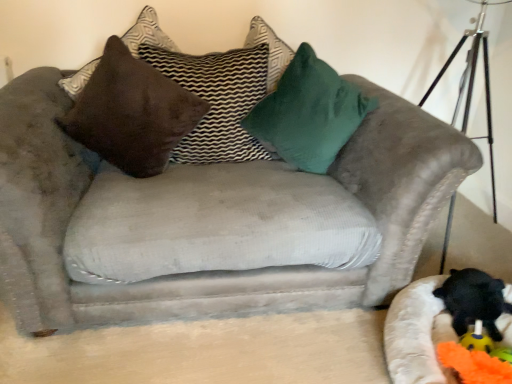
Question: Considering the relative sizes of orange fabric toy at lower right and black plush toy at lower right in the image provided, is orange fabric toy at lower right shorter than black plush toy at lower right?

Choices:
 (A) yes
 (B) no

Answer: (A)

Question: From the image's perspective, would you say orange fabric toy at lower right is shown under black plush toy at lower right?

Choices:
 (A) yes
 (B) no

Answer: (A)

Question: From the image's perspective, is orange fabric toy at lower right above black plush toy at lower right?

Choices:
 (A) no
 (B) yes

Answer: (A)

Question: Is black plush toy at lower right a part of orange fabric toy at lower right?

Choices:
 (A) no
 (B) yes

Answer: (A)

Question: Is orange fabric toy at lower right positioned in front of black plush toy at lower right?

Choices:
 (A) yes
 (B) no

Answer: (A)

Question: Would you say orange fabric toy at lower right is outside black plush toy at lower right?

Choices:
 (A) yes
 (B) no

Answer: (A)

Question: Is green velvet pillow at upper center, the 1th pillow positioned from the right, looking in the opposite direction of orange fabric toy at lower right?

Choices:
 (A) no
 (B) yes

Answer: (A)

Question: Is green velvet pillow at upper center, the 1th pillow positioned from the right, behind orange fabric toy at lower right?

Choices:
 (A) no
 (B) yes

Answer: (B)

Question: Does green velvet pillow at upper center, the 1th pillow positioned from the right, appear on the right side of orange fabric toy at lower right?

Choices:
 (A) no
 (B) yes

Answer: (A)

Question: Considering the relative sizes of green velvet pillow at upper center, marked as the third pillow in a left-to-right arrangement, and orange fabric toy at lower right in the image provided, is green velvet pillow at upper center, marked as the third pillow in a left-to-right arrangement, wider than orange fabric toy at lower right?

Choices:
 (A) yes
 (B) no

Answer: (A)

Question: Is green velvet pillow at upper center, marked as the third pillow in a left-to-right arrangement, not within orange fabric toy at lower right?

Choices:
 (A) yes
 (B) no

Answer: (A)

Question: Considering the relative sizes of green velvet pillow at upper center, marked as the third pillow in a left-to-right arrangement, and orange fabric toy at lower right in the image provided, is green velvet pillow at upper center, marked as the third pillow in a left-to-right arrangement, shorter than orange fabric toy at lower right?

Choices:
 (A) yes
 (B) no

Answer: (B)

Question: Does black plush toy at lower right have a lesser width compared to orange fabric toy at lower right?

Choices:
 (A) yes
 (B) no

Answer: (A)